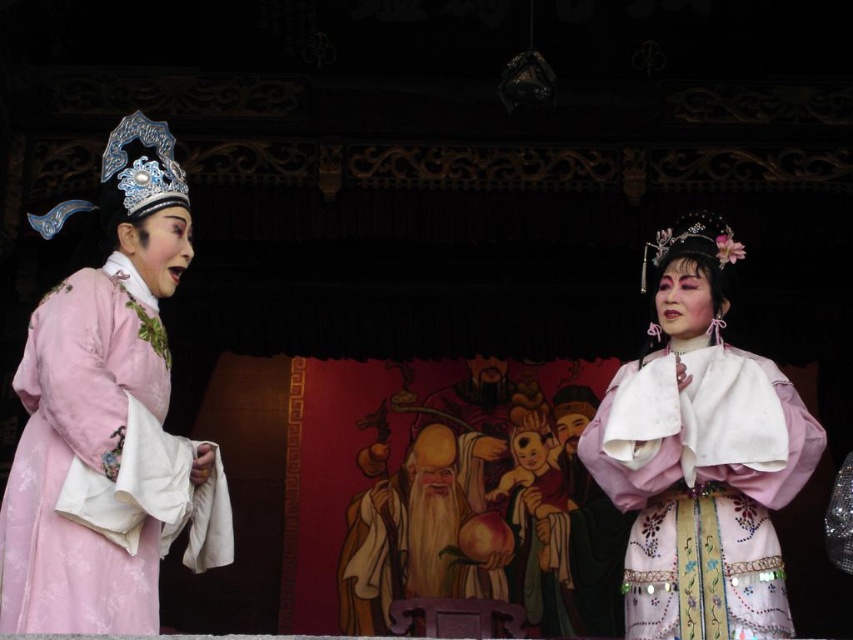
Between matte pink robe at left and matte pink silk robe at center, which one is positioned higher?

Positioned higher is matte pink robe at left.

Locate an element on the screen. The image size is (853, 640). matte pink robe at left is located at coordinates (108, 419).

I want to click on matte pink robe at left, so click(x=108, y=419).